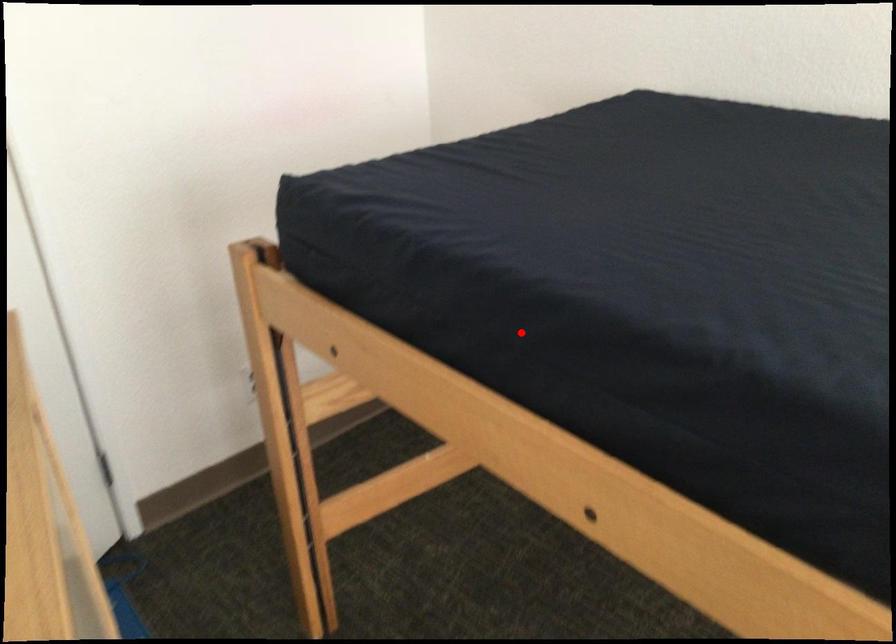
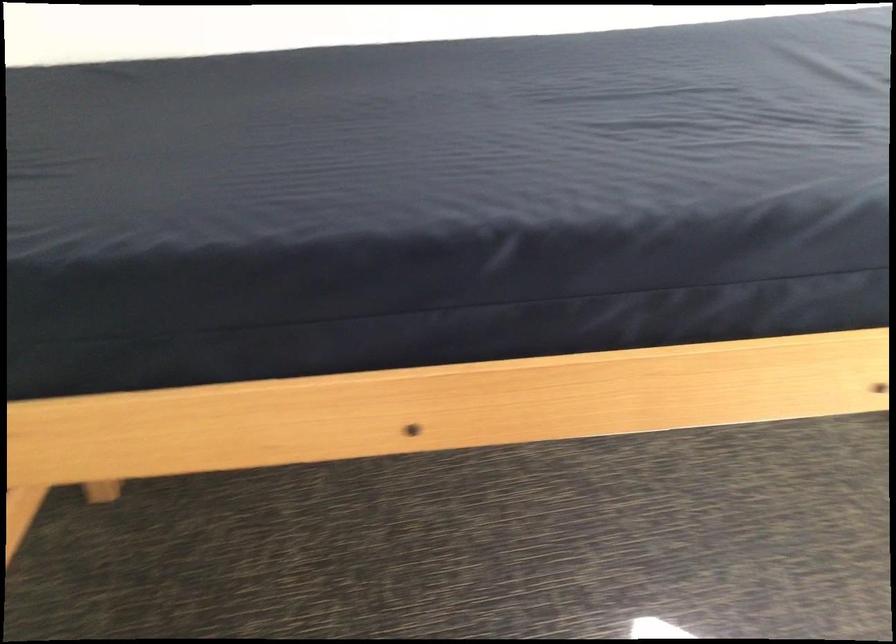
Find the pixel in the second image that matches the highlighted location in the first image.

(254, 308)